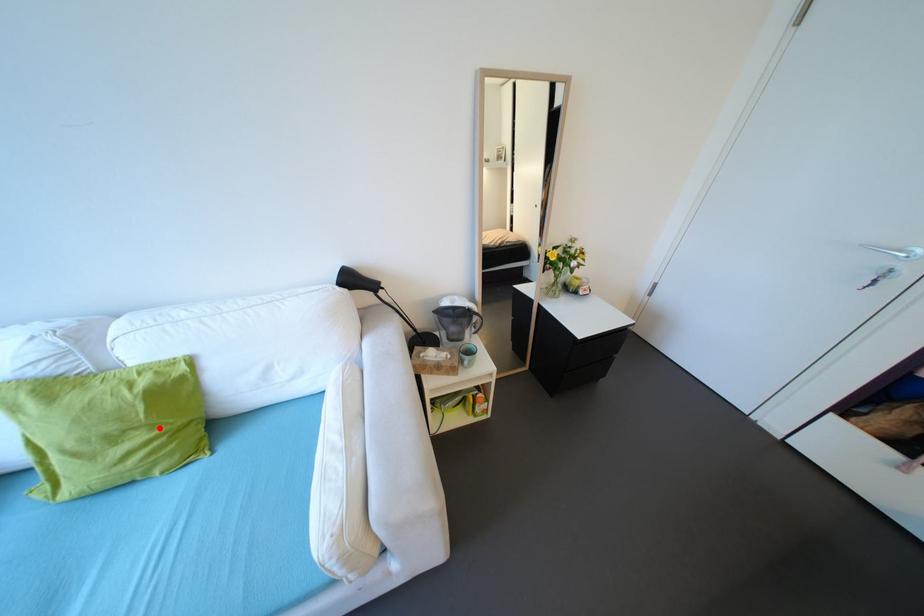
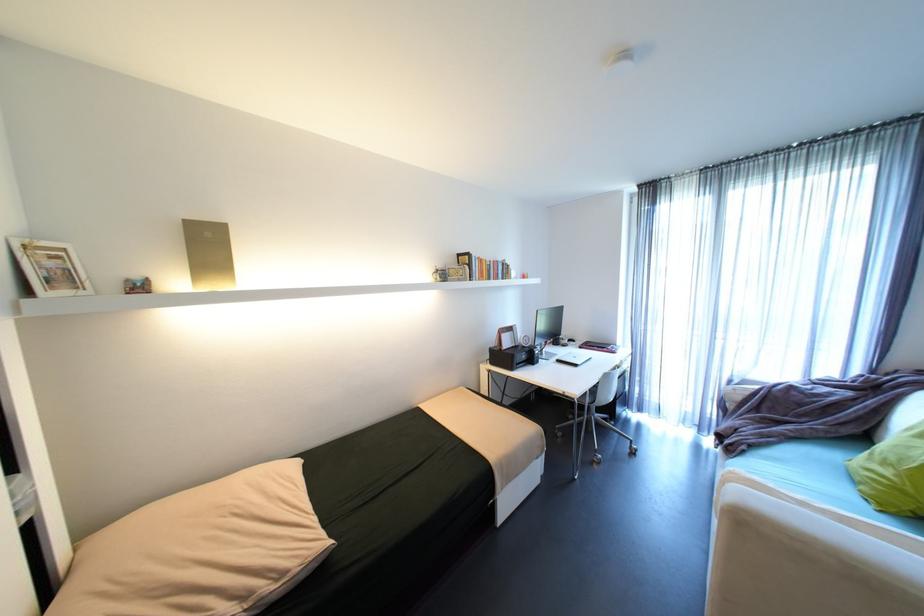
Question: I am providing you with two images of the same scene from different viewpoints. A red point is marked on the first image. Is the red point's position out of view in image 2?

Choices:
 (A) Yes
 (B) No

Answer: (B)